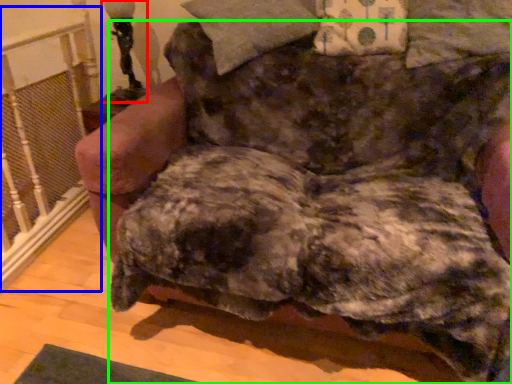
Question: Based on their relative distances, which object is nearer to table lamp (highlighted by a red box)? Choose from rail (highlighted by a blue box) and dog (highlighted by a green box).

Choices:
 (A) rail
 (B) dog

Answer: (A)